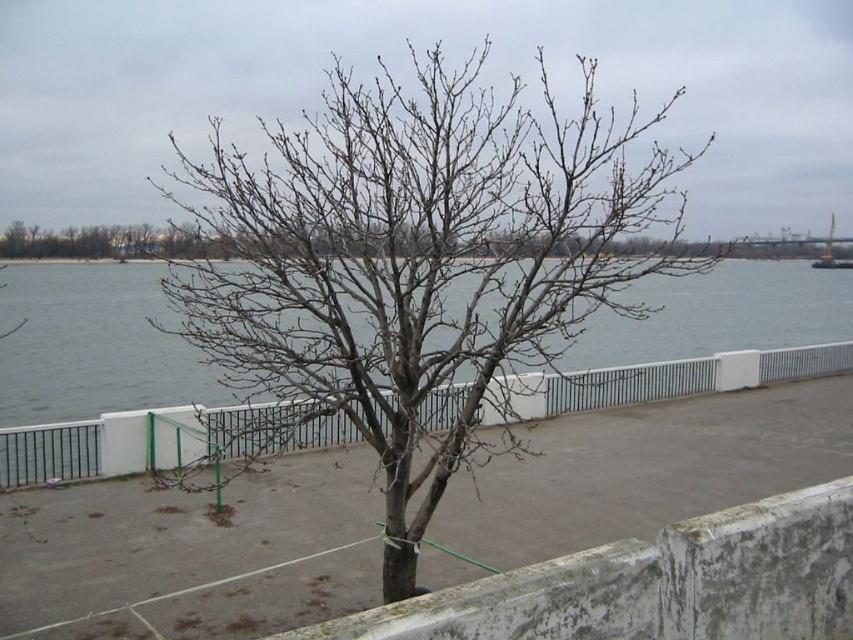
Find the location of a particular element. The image size is (853, 640). white concrete fence at center is located at coordinates (675, 378).

Is white concrete fence at center closer to camera compared to metallic yellow crane at upper right?

Yes, it is.

Which is in front, point (67, 436) or point (834, 264)?

Point (67, 436) is in front.

Locate an element on the screen. The height and width of the screenshot is (640, 853). white concrete fence at center is located at coordinates (675, 378).

Who is taller, bare branches at center or white concrete fence at center?

With more height is bare branches at center.

Looking at this image, does bare branches at center come behind white concrete fence at center?

That is False.

Is point (331, 360) positioned in front of point (15, 484)?

Yes, point (331, 360) is closer to viewer.

In order to click on bare branches at center in this screenshot , I will do `click(416, 259)`.

Is bare branches at center behind metallic yellow crane at upper right?

No, it is in front of metallic yellow crane at upper right.

Which is behind, point (370, 102) or point (840, 264)?

Point (840, 264)

The width and height of the screenshot is (853, 640). Describe the element at coordinates (416, 259) in the screenshot. I see `bare branches at center` at that location.

Where is `bare branches at center`? The image size is (853, 640). bare branches at center is located at coordinates (416, 259).